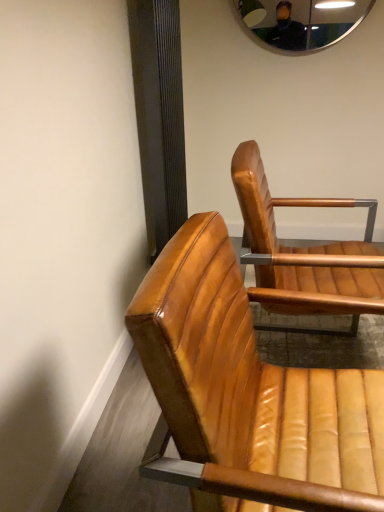
Image resolution: width=384 pixels, height=512 pixels. Describe the element at coordinates (305, 253) in the screenshot. I see `leather tan chair at center, positioned as the 1th chair in back-to-front order` at that location.

Describe the element at coordinates (247, 395) in the screenshot. I see `leather chair at lower right, positioned as the second chair in back-to-front order` at that location.

The width and height of the screenshot is (384, 512). Identify the location of leather tan chair at center, the second chair viewed from the front. (305, 253).

Which is closer to the camera, (250, 237) or (265, 2)?

Point (250, 237) is closer to the camera than point (265, 2).

Considering the positions of objects leather tan chair at center, positioned as the 1th chair in back-to-front order, and metallic reflective mirror at upper center in the image provided, who is more to the right, leather tan chair at center, positioned as the 1th chair in back-to-front order, or metallic reflective mirror at upper center?

From the viewer's perspective, metallic reflective mirror at upper center appears more on the right side.

This screenshot has height=512, width=384. Identify the location of chair that is the 1st object located below the metallic reflective mirror at upper center (from the image's perspective). (305, 253).

How far apart are leather chair at lower right, which is the 1th chair in front-to-back order, and metallic reflective mirror at upper center?

The distance of leather chair at lower right, which is the 1th chair in front-to-back order, from metallic reflective mirror at upper center is 6.96 feet.

Which is less distant, (355, 483) or (298, 27)?

Clearly, point (355, 483) is closer to the camera than point (298, 27).

Is leather chair at lower right, positioned as the second chair in back-to-front order, beside metallic reflective mirror at upper center?

leather chair at lower right, positioned as the second chair in back-to-front order, and metallic reflective mirror at upper center are not in contact.

Consider the image. From a real-world perspective, which object stands above the other?

metallic reflective mirror at upper center.

Is leather chair at lower right, which is the 1th chair in front-to-back order, in contact with leather tan chair at center, positioned as the 1th chair in back-to-front order?

There is a gap between leather chair at lower right, which is the 1th chair in front-to-back order, and leather tan chair at center, positioned as the 1th chair in back-to-front order.

In the scene shown: Does leather chair at lower right, positioned as the second chair in back-to-front order, have a greater height compared to leather tan chair at center, the second chair viewed from the front?

No, leather chair at lower right, positioned as the second chair in back-to-front order, is not taller than leather tan chair at center, the second chair viewed from the front.

Can you confirm if leather chair at lower right, positioned as the second chair in back-to-front order, is smaller than leather tan chair at center, the second chair viewed from the front?

Yes, leather chair at lower right, positioned as the second chair in back-to-front order, is smaller than leather tan chair at center, the second chair viewed from the front.

In the scene shown: Does leather chair at lower right, positioned as the second chair in back-to-front order, come in front of leather tan chair at center, the second chair viewed from the front?

Yes, it is.

How far apart are metallic reflective mirror at upper center and leather chair at lower right, positioned as the second chair in back-to-front order?

metallic reflective mirror at upper center is 6.96 feet from leather chair at lower right, positioned as the second chair in back-to-front order.

Considering the positions of points (335, 6) and (298, 414), is point (335, 6) closer to camera compared to point (298, 414)?

No, it is not.

In order to click on chair that is the 2nd object located in front of the metallic reflective mirror at upper center in this screenshot , I will do `click(247, 395)`.

Can you confirm if metallic reflective mirror at upper center is taller than leather chair at lower right, which is the 1th chair in front-to-back order?

Incorrect, the height of metallic reflective mirror at upper center is not larger of that of leather chair at lower right, which is the 1th chair in front-to-back order.

Which of these two, leather tan chair at center, the second chair viewed from the front, or leather chair at lower right, positioned as the second chair in back-to-front order, stands taller?

Standing taller between the two is leather tan chair at center, the second chair viewed from the front.

This screenshot has width=384, height=512. In order to click on chair on the right of leather chair at lower right, positioned as the second chair in back-to-front order in this screenshot , I will do `click(305, 253)`.

Which object is positioned more to the left, leather tan chair at center, the second chair viewed from the front, or leather chair at lower right, positioned as the second chair in back-to-front order?

leather chair at lower right, positioned as the second chair in back-to-front order, is more to the left.

From the picture: How many degrees apart are the facing directions of leather tan chair at center, the second chair viewed from the front, and leather chair at lower right, which is the 1th chair in front-to-back order?

4.02 degrees separate the facing orientations of leather tan chair at center, the second chair viewed from the front, and leather chair at lower right, which is the 1th chair in front-to-back order.

Looking at this image, from the image's perspective, is metallic reflective mirror at upper center below leather tan chair at center, the second chair viewed from the front?

No.

Is metallic reflective mirror at upper center to the left or to the right of leather tan chair at center, the second chair viewed from the front, in the image?

Clearly, metallic reflective mirror at upper center is on the right of leather tan chair at center, the second chair viewed from the front, in the image.

From a real-world perspective, does metallic reflective mirror at upper center sit lower than leather tan chair at center, the second chair viewed from the front?

Incorrect, from a real-world perspective, metallic reflective mirror at upper center is higher than leather tan chair at center, the second chair viewed from the front.

Is the surface of metallic reflective mirror at upper center in direct contact with leather tan chair at center, the second chair viewed from the front?

metallic reflective mirror at upper center and leather tan chair at center, the second chair viewed from the front, are not in contact.

From the image's perspective, starting from the metallic reflective mirror at upper center, which chair is the 1st one below? Please provide its 2D coordinates.

[(305, 253)]

In order to click on mirror that is on the right side of leather chair at lower right, positioned as the second chair in back-to-front order in this screenshot , I will do `click(302, 21)`.

Considering their positions, is metallic reflective mirror at upper center positioned closer to leather tan chair at center, positioned as the 1th chair in back-to-front order, than leather chair at lower right, positioned as the second chair in back-to-front order?

The object closer to leather tan chair at center, positioned as the 1th chair in back-to-front order, is leather chair at lower right, positioned as the second chair in back-to-front order.

Which object lies nearer to the anchor point leather chair at lower right, positioned as the second chair in back-to-front order, leather tan chair at center, the second chair viewed from the front, or metallic reflective mirror at upper center?

leather tan chair at center, the second chair viewed from the front.

Consider the image. From the image, which object appears to be nearer to metallic reflective mirror at upper center, leather chair at lower right, which is the 1th chair in front-to-back order, or leather tan chair at center, the second chair viewed from the front?

The object closer to metallic reflective mirror at upper center is leather tan chair at center, the second chair viewed from the front.

Which object lies nearer to the anchor point leather tan chair at center, the second chair viewed from the front, leather chair at lower right, positioned as the second chair in back-to-front order, or metallic reflective mirror at upper center?

The object closer to leather tan chair at center, the second chair viewed from the front, is leather chair at lower right, positioned as the second chair in back-to-front order.

Estimate the real-world distances between objects in this image. Which object is further from metallic reflective mirror at upper center, leather tan chair at center, positioned as the 1th chair in back-to-front order, or leather chair at lower right, which is the 1th chair in front-to-back order?

The object further to metallic reflective mirror at upper center is leather chair at lower right, which is the 1th chair in front-to-back order.

When comparing their distances from leather chair at lower right, positioned as the second chair in back-to-front order, does metallic reflective mirror at upper center or leather tan chair at center, positioned as the 1th chair in back-to-front order, seem further?

metallic reflective mirror at upper center is further to leather chair at lower right, positioned as the second chair in back-to-front order.

I want to click on chair between leather chair at lower right, positioned as the second chair in back-to-front order, and metallic reflective mirror at upper center from front to back, so click(x=305, y=253).